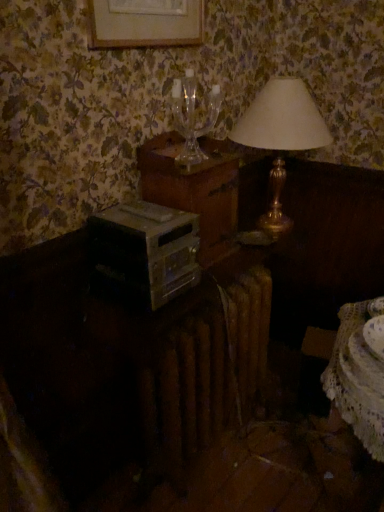
What are the coordinates of `vacant area on top of silver metallic stereo at center (from a real-world perspective)` in the screenshot? It's located at (143, 214).